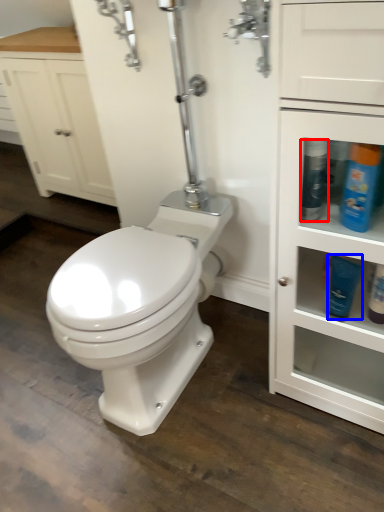
Question: Which of the following is the closest to the observer, cleaning product (highlighted by a red box) or toiletry (highlighted by a blue box)?

Choices:
 (A) cleaning product
 (B) toiletry

Answer: (A)